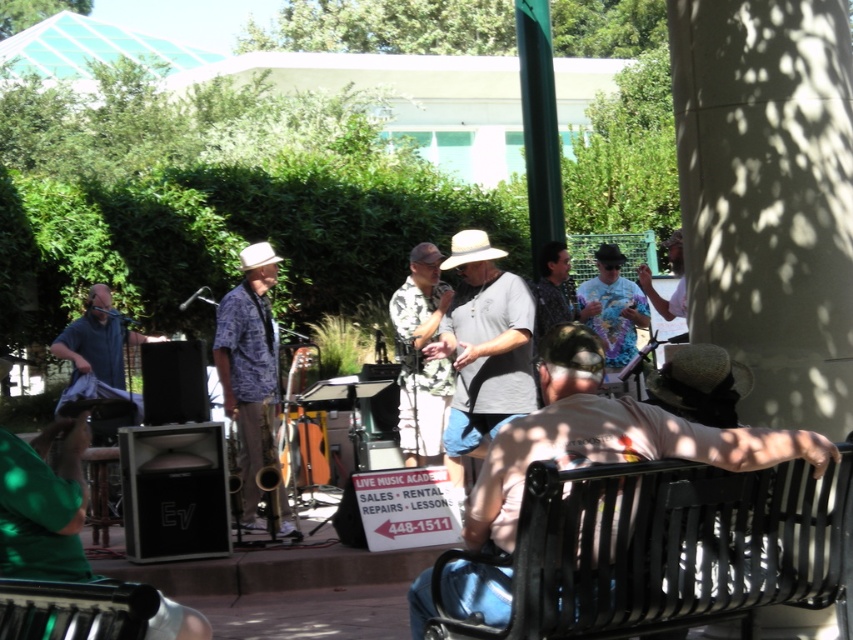
Does brown leather hat at lower right come behind tie-dye shirt at center?

No, brown leather hat at lower right is closer to the viewer.

Is point (584, 417) more distant than point (590, 314)?

No, it is in front of (590, 314).

Is point (480, 474) closer to viewer compared to point (604, 333)?

Yes, point (480, 474) is in front of point (604, 333).

Identify the location of brown leather hat at lower right. The width and height of the screenshot is (853, 640). (607, 436).

Who is more forward, (474,321) or (303,412)?

Point (474,321) is more forward.

Between gray cotton shirt at center and wooden acoustic guitar at center, which one appears on the left side from the viewer's perspective?

wooden acoustic guitar at center

Does point (502, 339) lie behind point (294, 353)?

No, (502, 339) is in front of (294, 353).

Find the location of a particular element. The image size is (853, 640). gray cotton shirt at center is located at coordinates (485, 348).

Can you confirm if blue floral shirt at center is positioned to the right of blue fabric shirt at left?

Yes, blue floral shirt at center is to the right of blue fabric shirt at left.

Is point (264, 248) positioned behind point (109, 396)?

No, (264, 248) is in front of (109, 396).

This screenshot has width=853, height=640. Find the location of `blue floral shirt at center`. blue floral shirt at center is located at coordinates (248, 369).